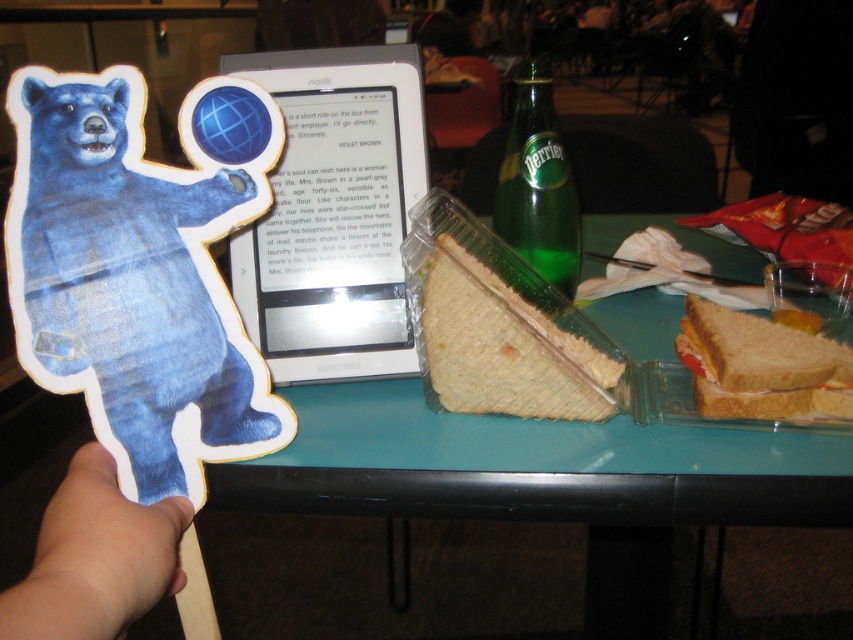
Between blue paper bear at left and golden brown bread at right, which one is positioned lower?

golden brown bread at right

Is point (213, 305) closer to camera compared to point (711, 312)?

That is True.

Locate an element on the screen. This screenshot has height=640, width=853. blue paper bear at left is located at coordinates (141, 269).

Is blue paper bear at left bigger than skinny tan hand at lower left?

Correct, blue paper bear at left is larger in size than skinny tan hand at lower left.

Who is taller, blue paper bear at left or skinny tan hand at lower left?

Standing taller between the two is blue paper bear at left.

Identify the location of blue paper bear at left. The width and height of the screenshot is (853, 640). (141, 269).

Locate an element on the screen. blue paper bear at left is located at coordinates (141, 269).

Is point (828, 356) farther from camera compared to point (495, 198)?

That is False.

This screenshot has height=640, width=853. What are the coordinates of `golden brown bread at right` in the screenshot? It's located at (759, 365).

Is point (840, 353) more distant than point (561, 250)?

That is False.

You are a GUI agent. You are given a task and a screenshot of the screen. Output one action in this format:
    pyautogui.click(x=<x>, y=<y>)
    Task: Click on the golden brown bread at right
    
    Given the screenshot: What is the action you would take?
    pyautogui.click(x=759, y=365)